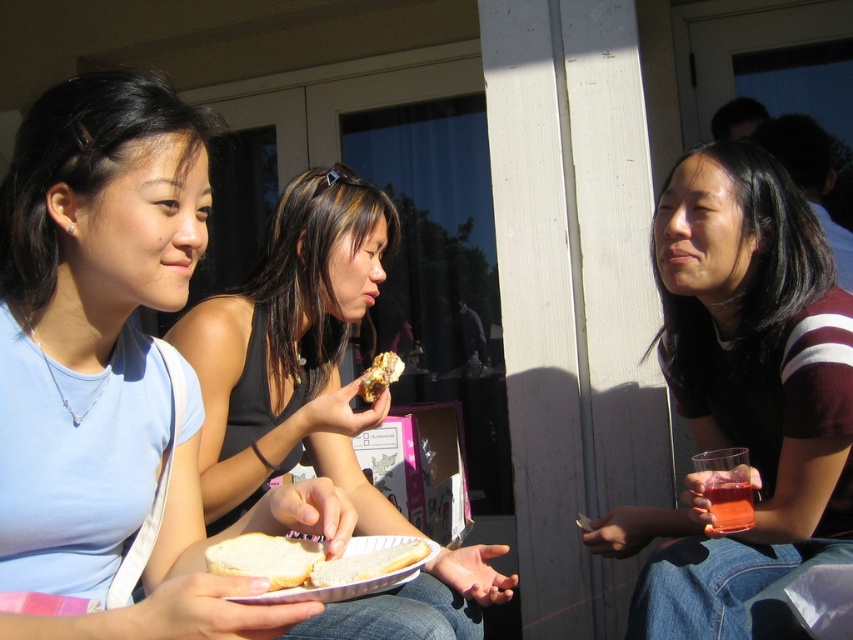
Question: Which of these objects is positioned closest to the matte black shirt at center?

Choices:
 (A) white bread at center
 (B) light blue cotton shirt at center
 (C) golden textured bread at center

Answer: (C)

Question: Can you confirm if matte black tank top at center is positioned below white bread at center?

Choices:
 (A) yes
 (B) no

Answer: (B)

Question: Is light blue cotton shirt at center smaller than matte black shirt at center?

Choices:
 (A) yes
 (B) no

Answer: (A)

Question: Which is farther from the matte black shirt at center?

Choices:
 (A) white bread at lower center
 (B) white bread at center
 (C) matte black tank top at center
 (D) translucent glass cup at lower right

Answer: (A)

Question: Which point is farther from the camera taking this photo?

Choices:
 (A) (717, 500)
 (B) (407, 632)
 (C) (148, 163)

Answer: (A)

Question: Can you confirm if matte black shirt at center is smaller than white bread at center?

Choices:
 (A) yes
 (B) no

Answer: (B)